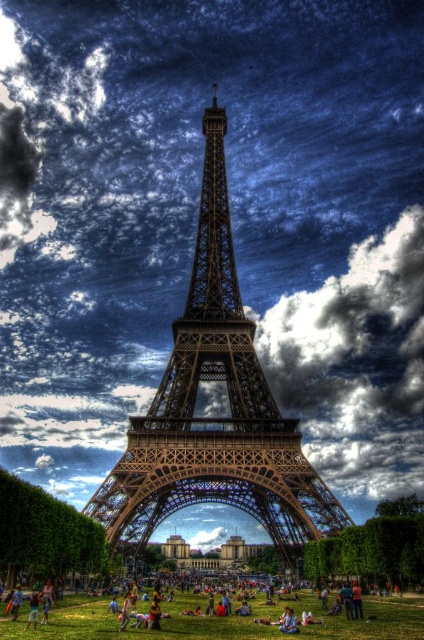
Is brown metallic eiffel tower at center below green grass at lower center?

Actually, brown metallic eiffel tower at center is above green grass at lower center.

Is point (150, 506) closer to viewer compared to point (404, 614)?

No, (150, 506) is further to viewer.

Where is `brown metallic eiffel tower at center`? brown metallic eiffel tower at center is located at coordinates pyautogui.click(x=214, y=417).